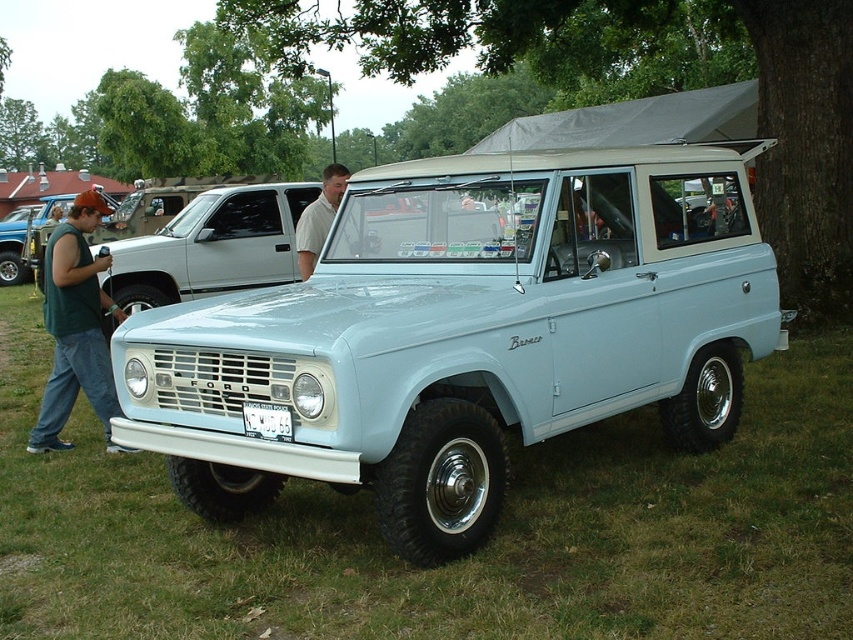
Looking at this image, can you confirm if light blue matte vehicle at center is positioned above matte black truck at left?

Incorrect, light blue matte vehicle at center is not positioned above matte black truck at left.

Does light blue matte vehicle at center lie in front of matte black truck at left?

Yes, it is in front of matte black truck at left.

The height and width of the screenshot is (640, 853). What do you see at coordinates (461, 561) in the screenshot?
I see `light blue matte vehicle at center` at bounding box center [461, 561].

The height and width of the screenshot is (640, 853). I want to click on light blue matte vehicle at center, so tap(461, 561).

Who is more forward, (x=582, y=504) or (x=340, y=186)?

Positioned in front is point (x=582, y=504).

Is light blue matte vehicle at center further to the viewer compared to light beige shirt at center?

No, light blue matte vehicle at center is in front of light beige shirt at center.

Which is behind, point (659, 538) or point (299, 230)?

Positioned behind is point (299, 230).

Locate an element on the screen. light blue matte vehicle at center is located at coordinates (461, 561).

Does light blue matte bronco at center lie in front of light beige shirt at center?

Yes, it is in front of light beige shirt at center.

Can you confirm if light blue matte bronco at center is thinner than light beige shirt at center?

In fact, light blue matte bronco at center might be wider than light beige shirt at center.

I want to click on light blue matte bronco at center, so click(x=463, y=333).